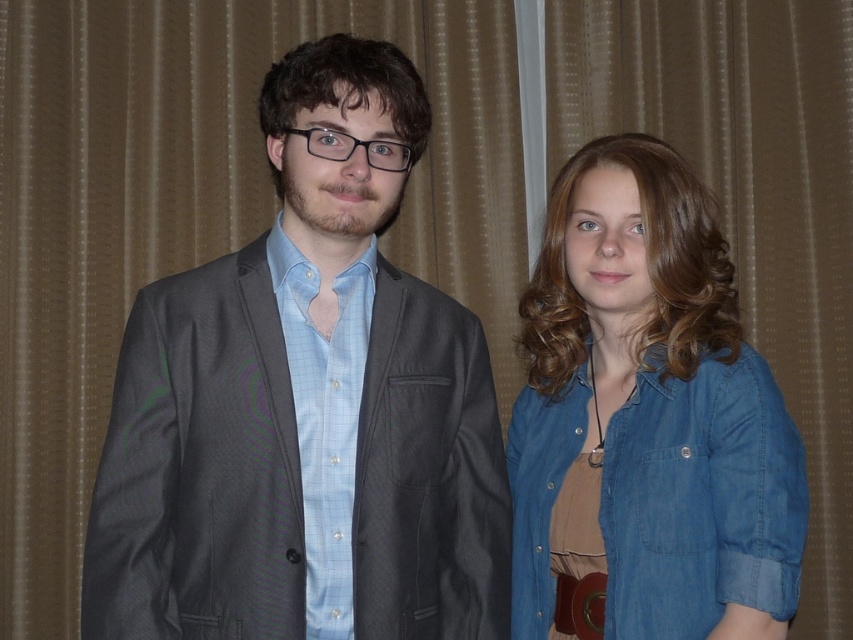
Question: Does matte gray blazer at center have a smaller size compared to denim shirt at right?

Choices:
 (A) no
 (B) yes

Answer: (A)

Question: Which object appears closest to the camera in this image?

Choices:
 (A) denim shirt at right
 (B) brown leather belt at lower center

Answer: (A)

Question: Where is denim shirt at right located in relation to brown leather belt at lower center in the image?

Choices:
 (A) left
 (B) right

Answer: (B)

Question: Which point appears farthest from the camera in this image?

Choices:
 (A) (599, 556)
 (B) (306, 628)

Answer: (A)

Question: Considering the real-world distances, which object is closest to the brown leather belt at lower center?

Choices:
 (A) matte gray blazer at center
 (B) denim shirt at right

Answer: (B)

Question: Where is denim shirt at right located in relation to brown leather belt at lower center in the image?

Choices:
 (A) below
 (B) above

Answer: (B)